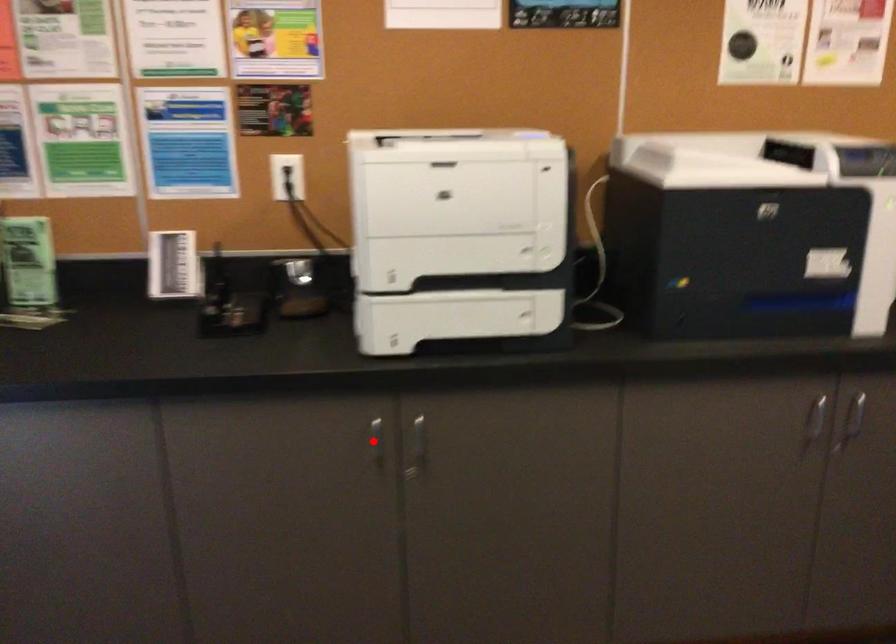
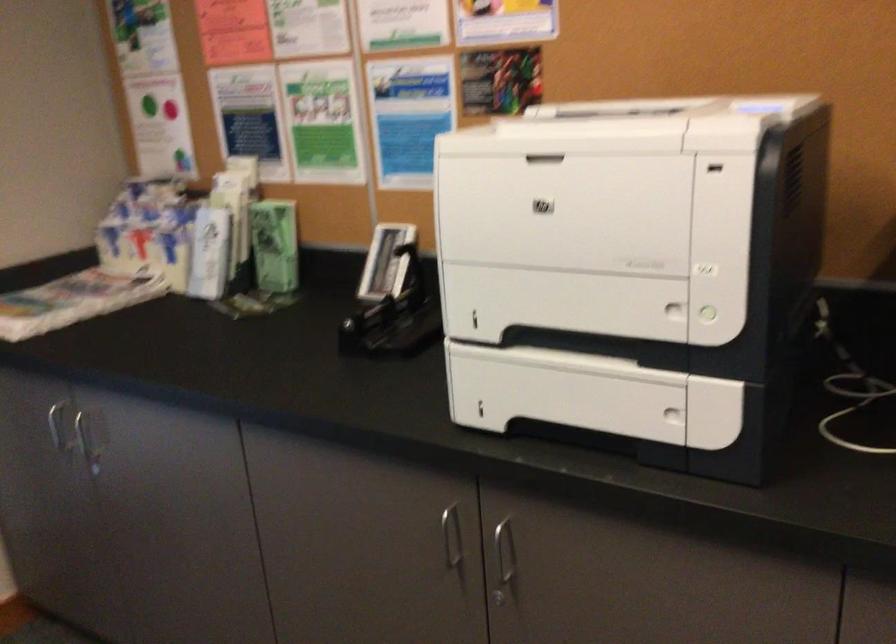
Question: I am providing you with two images of the same scene from different viewpoints. A red point is marked on the first image. Is the red point's position out of view in image 2?

Choices:
 (A) Yes
 (B) No

Answer: (B)